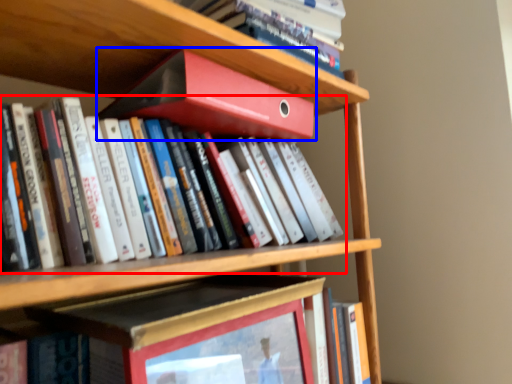
Question: Among these objects, which one is nearest to the camera, book (highlighted by a red box) or book (highlighted by a blue box)?

Choices:
 (A) book
 (B) book

Answer: (A)